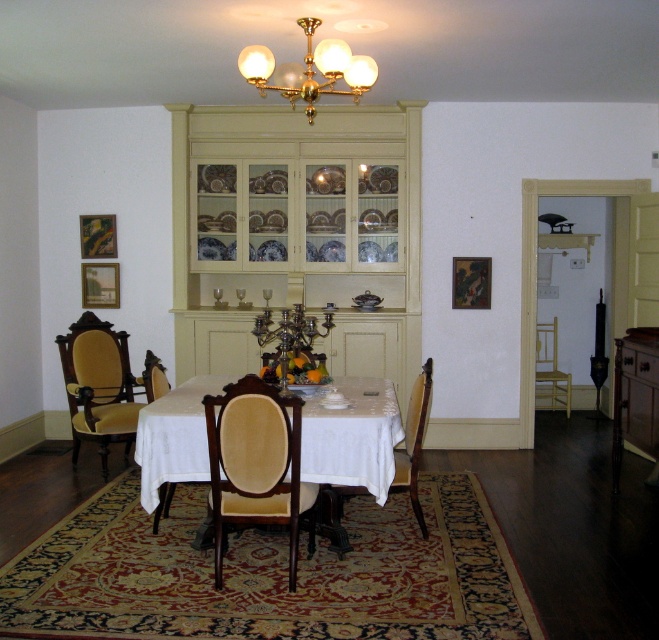
You are standing in the dining room and need to locate the velvet upholstered chair at left. According to the coordinates provided, where should you look?

The velvet upholstered chair at left is located at coordinates point (100, 385).